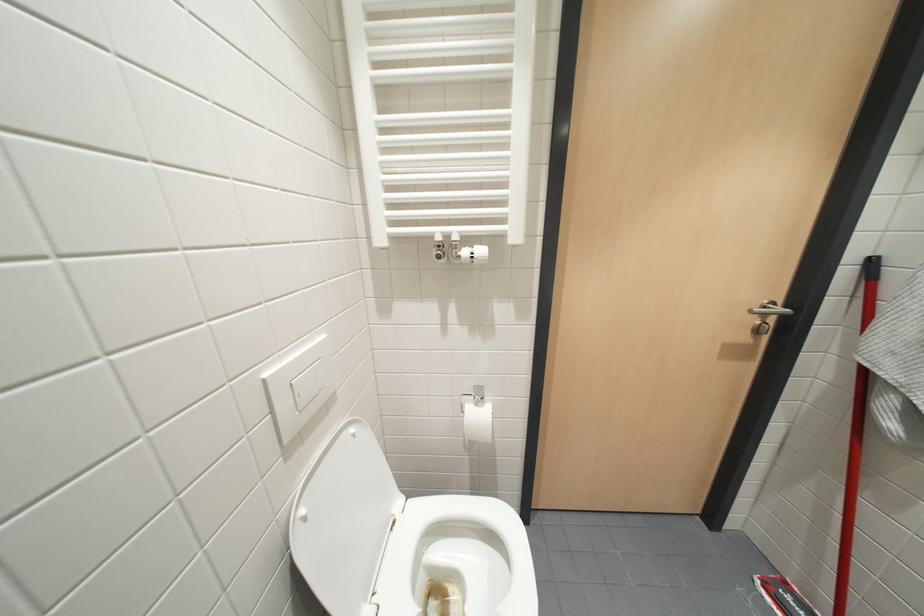
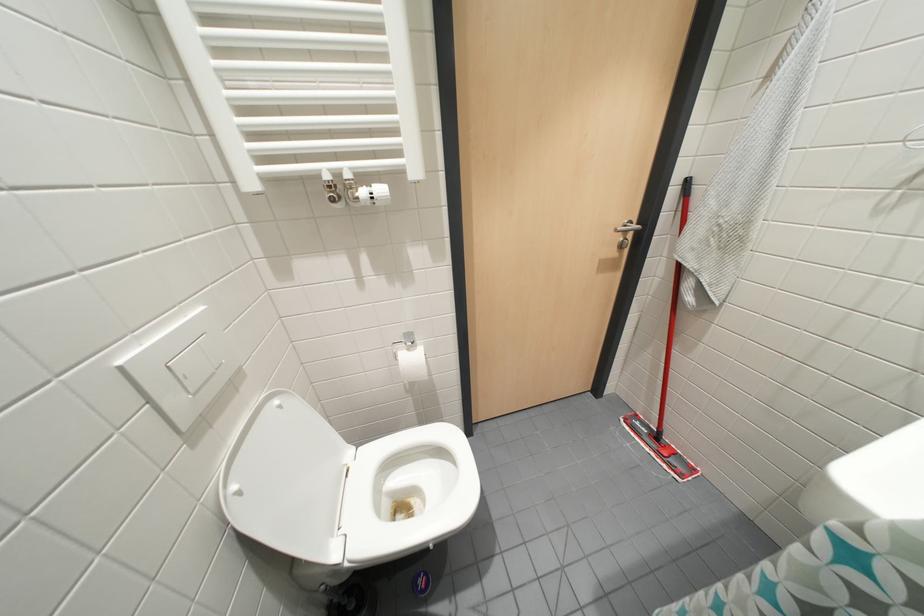
Question: The images are taken continuously from a first-person perspective. In which direction is your viewpoint rotating?

Choices:
 (A) Left
 (B) Right
 (C) Up
 (D) Down

Answer: (B)